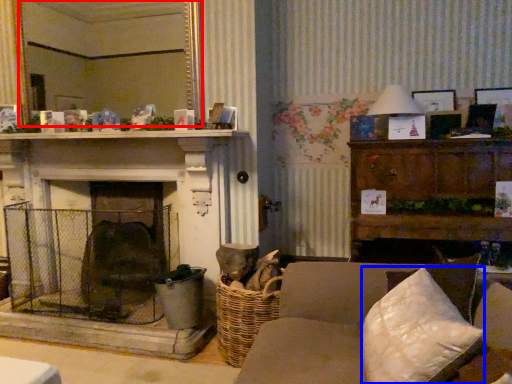
Question: Which of the following is the farthest to the observer, mirror (highlighted by a red box) or pillow (highlighted by a blue box)?

Choices:
 (A) mirror
 (B) pillow

Answer: (A)